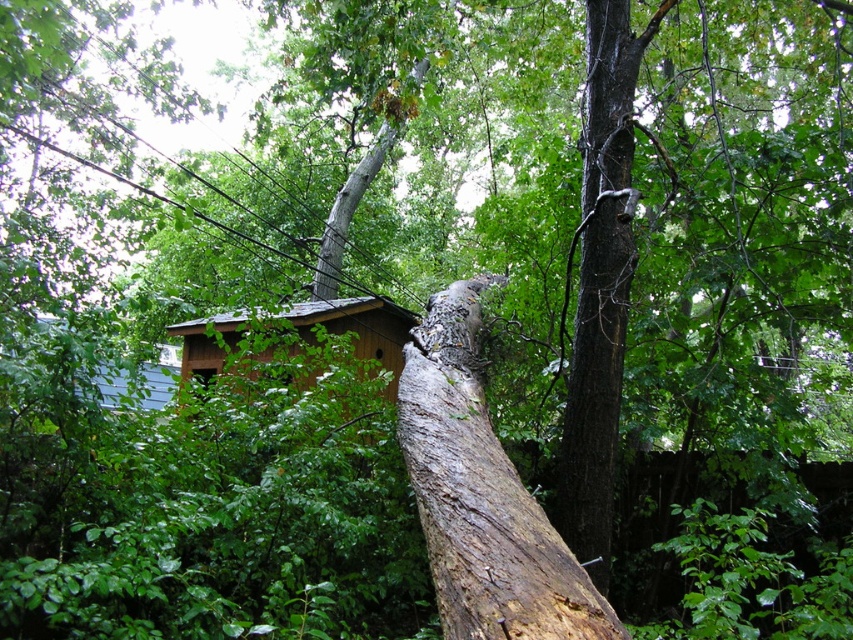
Question: Can you confirm if brown rough tree trunk at center is bigger than brown wooden hut at center?

Choices:
 (A) yes
 (B) no

Answer: (A)

Question: Which is farther from the brown rough tree trunk at center?

Choices:
 (A) brown wooden hut at center
 (B) brown rough bark at center

Answer: (A)

Question: Estimate the real-world distances between objects in this image. Which object is closer to the brown rough tree trunk at center?

Choices:
 (A) brown wooden hut at center
 (B) brown rough bark at center

Answer: (B)

Question: Can you confirm if brown rough bark at center is positioned below brown wooden hut at center?

Choices:
 (A) no
 (B) yes

Answer: (A)

Question: Does brown rough bark at center have a smaller size compared to brown wooden hut at center?

Choices:
 (A) yes
 (B) no

Answer: (B)

Question: Among these points, which one is farthest from the camera?

Choices:
 (A) (602, 454)
 (B) (212, 362)
 (C) (419, 484)

Answer: (B)